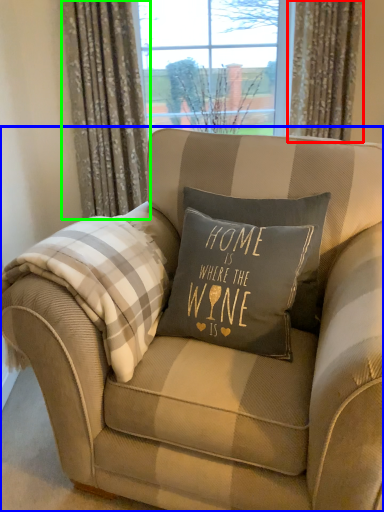
Question: Which object is positioned farthest from curtain (highlighted by a red box)? Select from chair (highlighted by a blue box) and curtain (highlighted by a green box).

Choices:
 (A) chair
 (B) curtain

Answer: (A)